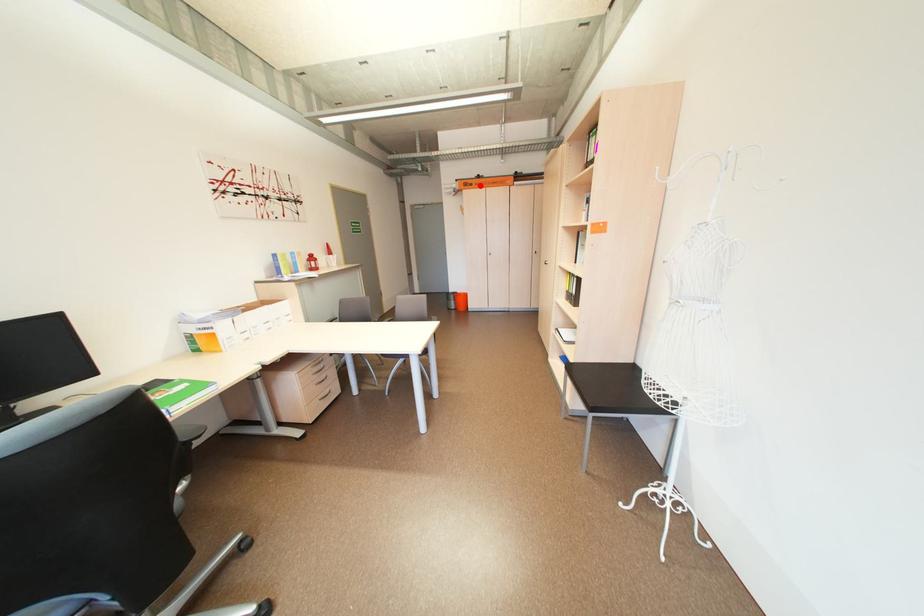
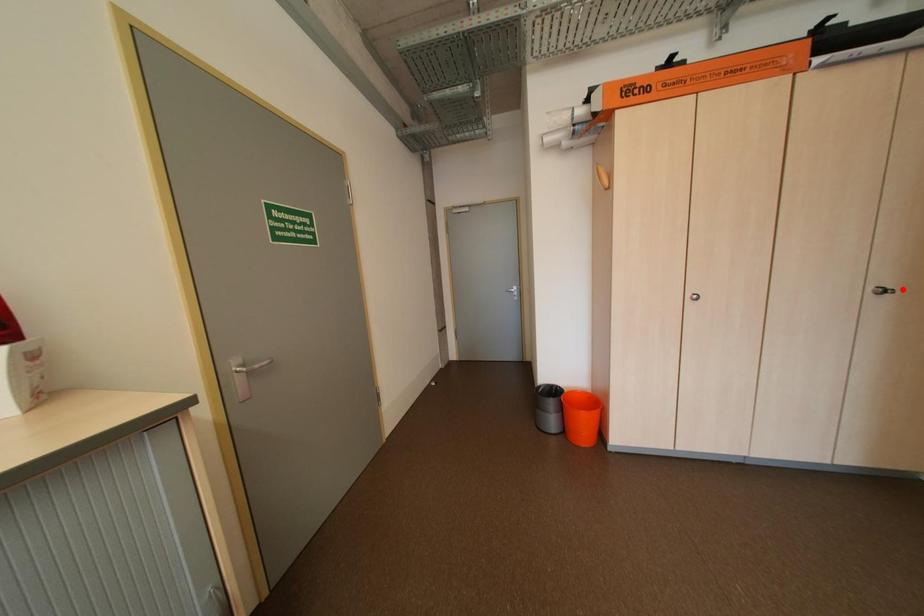
I am providing you with two images of the same scene from different viewpoints. A red point is marked on the first image and another point is marked on the second image. Are the points marked in image1 and image2 representing the same 3D position?

No